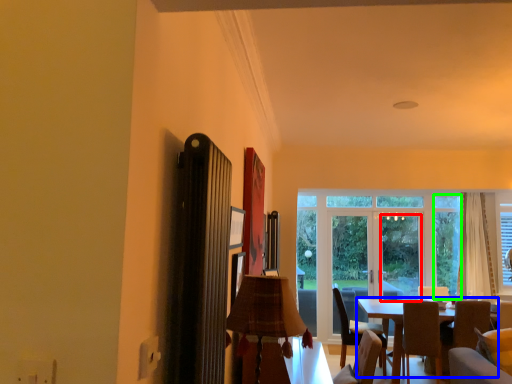
Question: Considering the real-world distances, which object is closest to window screen (highlighted by a red box)? table (highlighted by a blue box) or window (highlighted by a green box).

Choices:
 (A) table
 (B) window

Answer: (B)